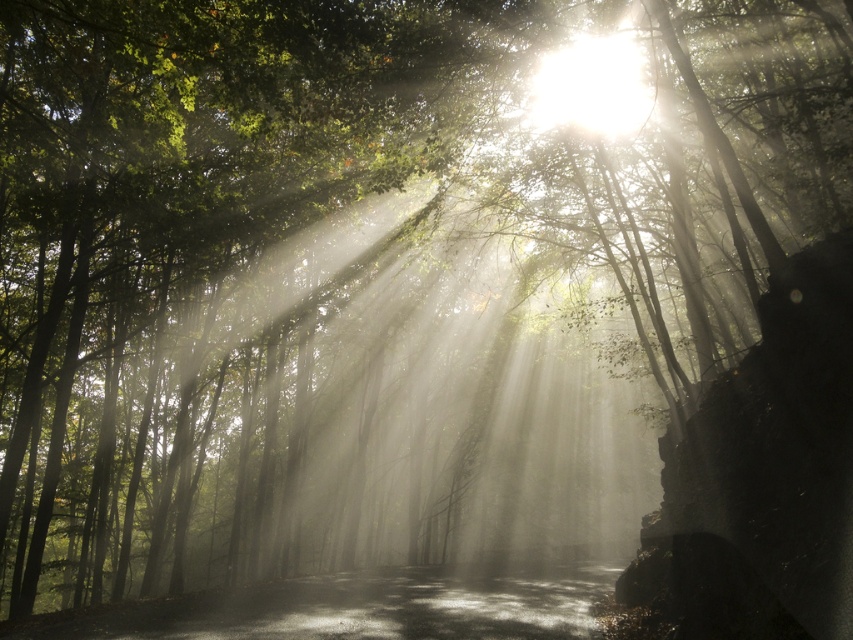
Is shiny asphalt road at center further to camera compared to bright white light at upper center?

No.

Is point (166, 616) positioned after point (537, 72)?

No, (166, 616) is in front of (537, 72).

Locate an element on the screen. The height and width of the screenshot is (640, 853). shiny asphalt road at center is located at coordinates (350, 609).